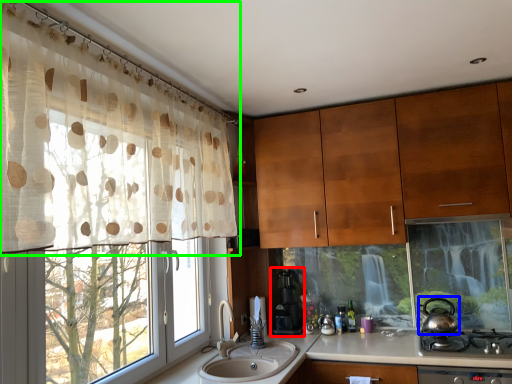
Question: Based on their relative distances, which object is nearer to coffee machine (highlighted by a red box)? Choose from tea pot (highlighted by a blue box) and curtain (highlighted by a green box).

Choices:
 (A) tea pot
 (B) curtain

Answer: (A)